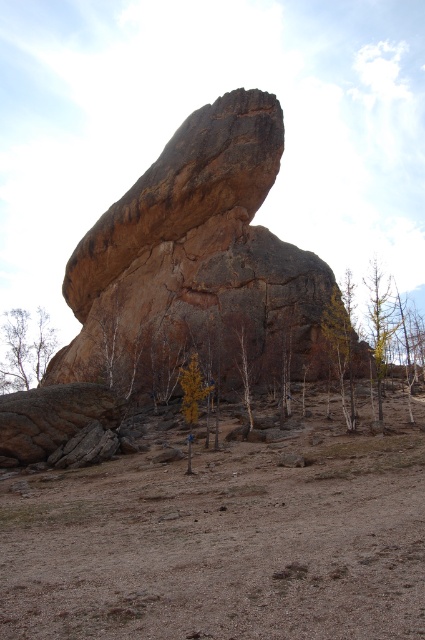
You are standing at the origin point in the image. Which direction should you move to reach the brown rough rock at center?

The brown rough rock at center is located at point 0.412 on the x and 0.473 on the y axis. Since you are at the origin, you should move towards the right and upwards to reach it.